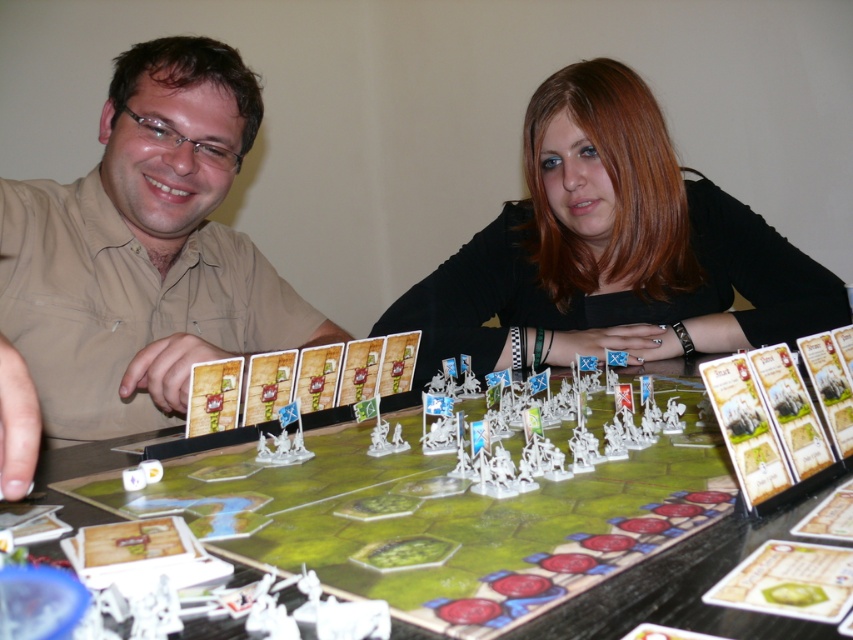
Can you confirm if matte plastic figures at center is wider than smooth black shirt at center?

Indeed, matte plastic figures at center has a greater width compared to smooth black shirt at center.

Between point (265, 268) and point (605, 182), which one is positioned behind?

Point (265, 268)

This screenshot has height=640, width=853. I want to click on matte plastic figures at center, so click(140, 260).

Where is `matte plastic figures at center`? The image size is (853, 640). matte plastic figures at center is located at coordinates (140, 260).

Is matte plastic figures at center shorter than matte beige shirt at left?

No, matte plastic figures at center is not shorter than matte beige shirt at left.

Is matte plastic figures at center taller than matte beige shirt at left?

Yes, matte plastic figures at center is taller than matte beige shirt at left.

Is point (138, 348) less distant than point (115, 378)?

No, (138, 348) is further to viewer.

Locate an element on the screen. matte plastic figures at center is located at coordinates (140, 260).

Is matte plastic figures at center thinner than green matte board game at center?

Incorrect, matte plastic figures at center's width is not less than green matte board game at center's.

Is matte plastic figures at center shorter than green matte board game at center?

No.

Image resolution: width=853 pixels, height=640 pixels. What do you see at coordinates (140, 260) in the screenshot? I see `matte plastic figures at center` at bounding box center [140, 260].

This screenshot has width=853, height=640. I want to click on matte plastic figures at center, so click(x=140, y=260).